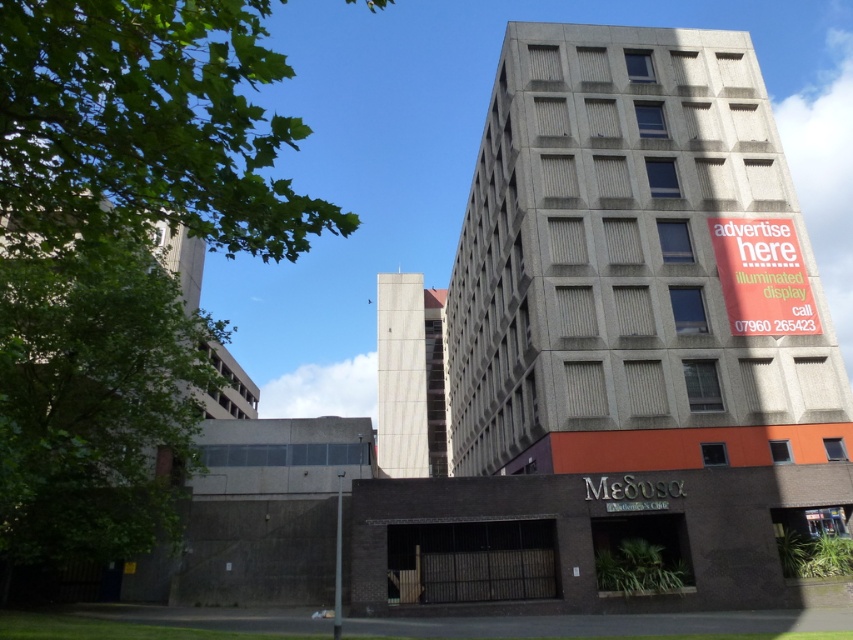
Question: Which object is positioned closest to the concrete building at upper right?

Choices:
 (A) white concrete building at center
 (B) green concrete building at left

Answer: (B)

Question: From the image, what is the correct spatial relationship of white concrete building at center in relation to green concrete building at left?

Choices:
 (A) below
 (B) above

Answer: (A)

Question: Does white concrete building at center appear over green concrete building at left?

Choices:
 (A) no
 (B) yes

Answer: (A)

Question: Which point is farther from the camera taking this photo?

Choices:
 (A) (569, 339)
 (B) (383, 394)

Answer: (B)

Question: Which of the following is the closest to the observer?

Choices:
 (A) green concrete building at left
 (B) concrete building at upper right
 (C) white concrete building at center

Answer: (A)

Question: Where is concrete building at upper right located in relation to green concrete building at left in the image?

Choices:
 (A) left
 (B) right

Answer: (B)